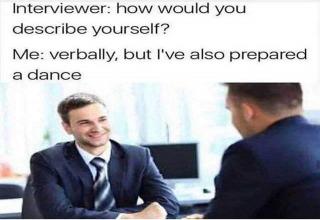
What are the coordinates of `computer monitor` in the screenshot? It's located at (182, 158).